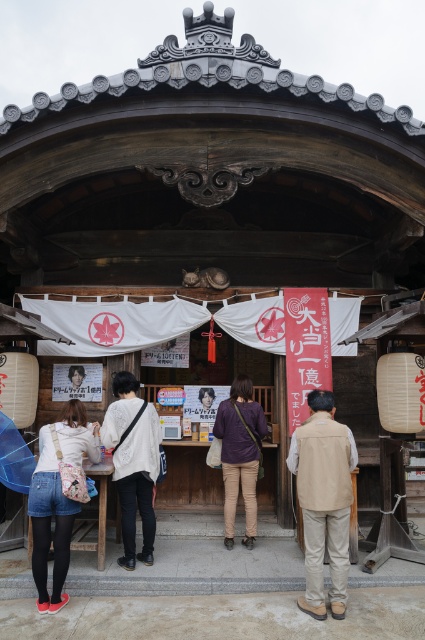
You are a visitor at the Japanese storefront and want to move from the beige fabric vest at lower right to the purple cotton shirt at center. What is the minimum width your wheelchair must be to safely navigate the path between them?

The distance between the beige fabric vest at lower right and purple cotton shirt at center is 1.39 meters. To safely navigate the path, your wheelchair must be at least 1.39 meters wide to pass through without touching either object.

You are standing at the entrance of the traditional Japanese storefront. You notice a point marked at coordinates (50, 524). Which object is this point located on?

The point at coordinates (50, 524) is located on the denim shorts at lower left.

Consider the image. You are standing in front of the traditional Japanese storefront. You see a pair of denim shorts at lower left. Where exactly are the denim shorts located in the scene?

The denim shorts at lower left are located at point (50, 524) in the scene.